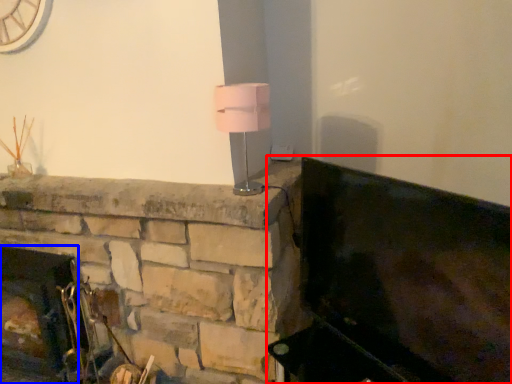
Question: Which of the following is the closest to the observer, furniture (highlighted by a red box) or fireplace (highlighted by a blue box)?

Choices:
 (A) furniture
 (B) fireplace

Answer: (A)